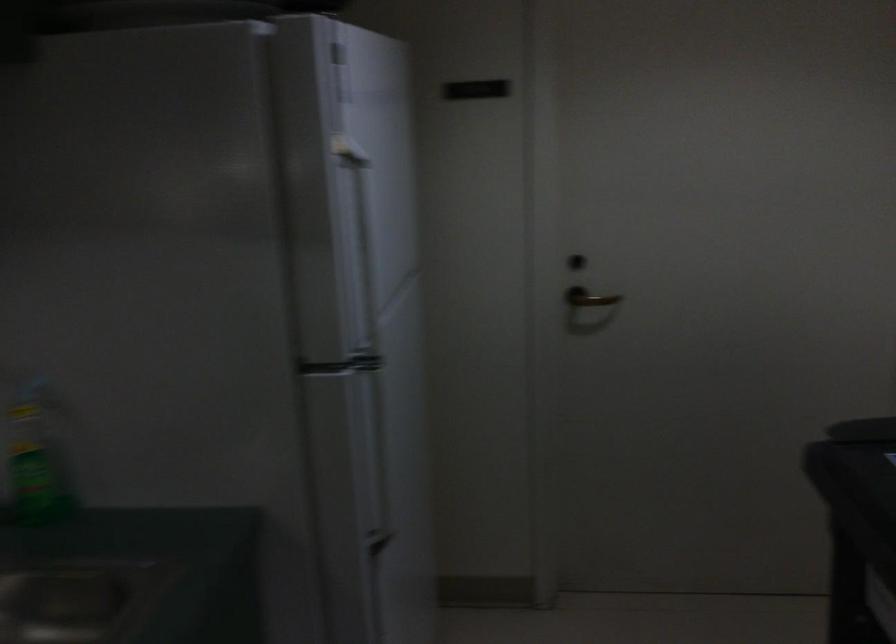
At what (x,y) coordinates should I click in order to perform the action: click on door handle. Please return your answer as a coordinate pair (x, y). Looking at the image, I should click on (589, 298).